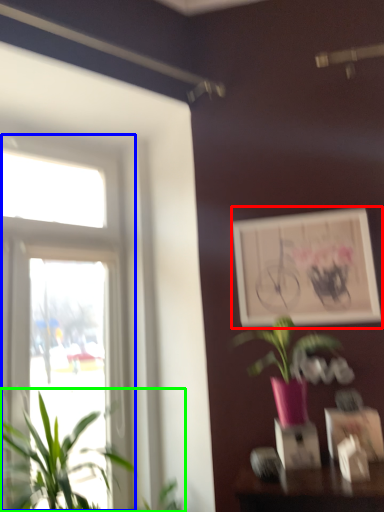
Question: Based on their relative distances, which object is nearer to picture frame (highlighted by a red box)? Choose from window (highlighted by a blue box) and houseplant (highlighted by a green box).

Choices:
 (A) window
 (B) houseplant

Answer: (A)